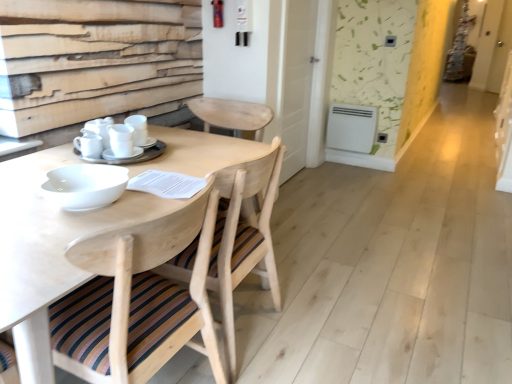
The height and width of the screenshot is (384, 512). Identify the location of empty space that is to the right of white matte cups at center, which appears as the 2th tableware when viewed from the left. (184, 156).